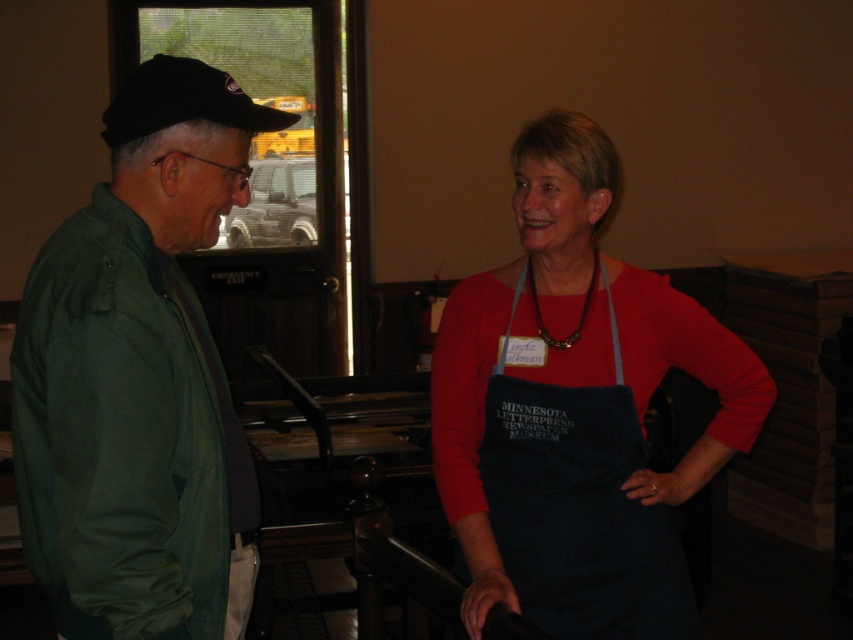
Question: Which point is closer to the camera?

Choices:
 (A) (33, 397)
 (B) (531, 582)

Answer: (A)

Question: Does green matte jacket at left come behind denim apron at center?

Choices:
 (A) no
 (B) yes

Answer: (A)

Question: Is green matte jacket at left closer to camera compared to denim apron at center?

Choices:
 (A) yes
 (B) no

Answer: (A)

Question: Can you confirm if green matte jacket at left is smaller than denim apron at center?

Choices:
 (A) yes
 (B) no

Answer: (A)

Question: Which point is closer to the camera taking this photo?

Choices:
 (A) (526, 173)
 (B) (136, 216)

Answer: (B)

Question: Which object appears closest to the camera in this image?

Choices:
 (A) green matte jacket at left
 (B) denim apron at center

Answer: (A)